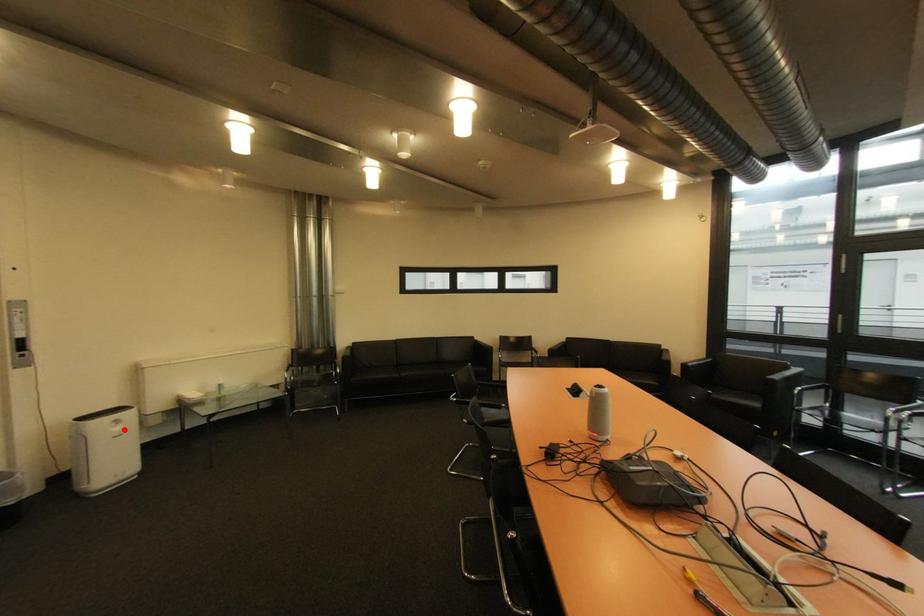
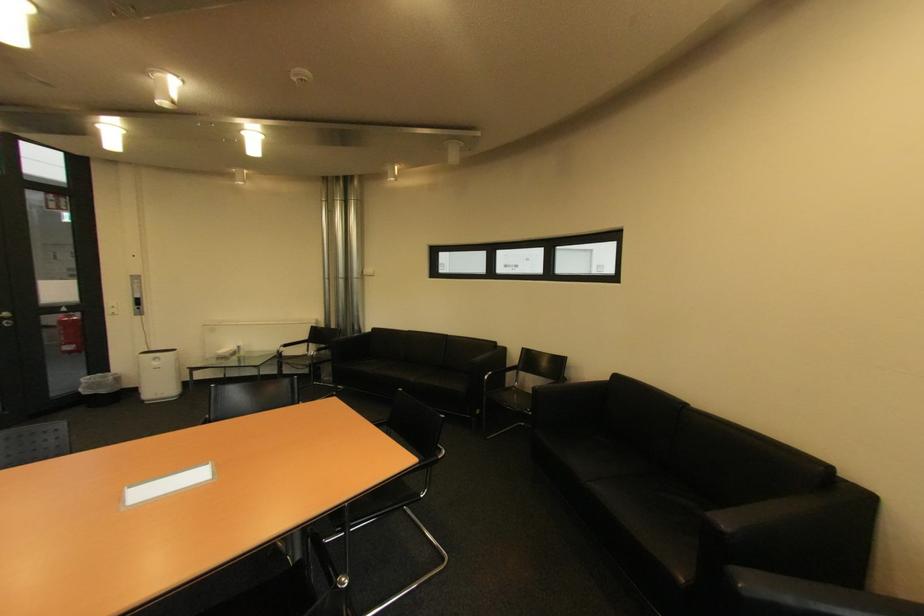
Locate, in the second image, the point that corresponds to the highlighted location in the first image.

(164, 363)